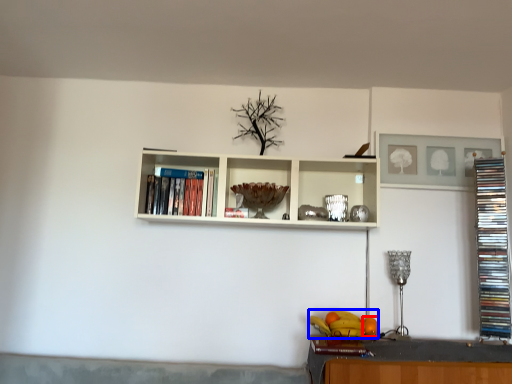
Question: Among these objects, which one is farthest to the camera, orange (highlighted by a red box) or fruit (highlighted by a blue box)?

Choices:
 (A) orange
 (B) fruit

Answer: (A)